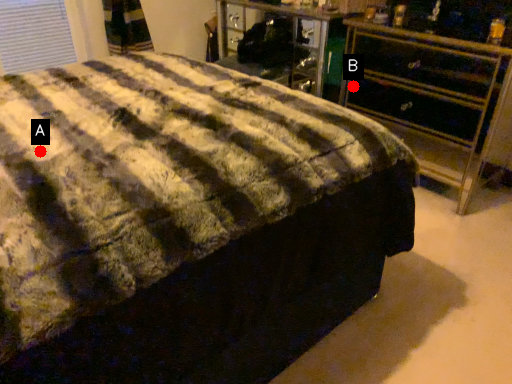
Question: Two points are circled on the image, labeled by A and B beside each circle. Which point is further to the camera?

Choices:
 (A) A is further
 (B) B is further

Answer: (B)